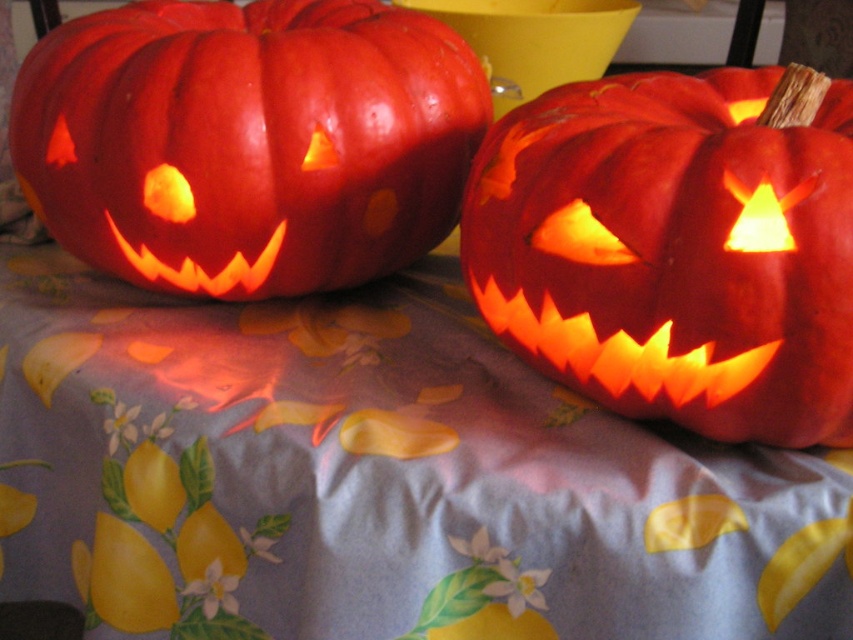
You are standing in front of the table with the two carved pumpkins. You notice two points marked on the tablecloth. Based on your perspective, which point is closer to you, point at position (837, 440) or point at position (56, 150)?

Point at position (837, 440) is closer to you than point at position (56, 150).

You are setting up a Halloween display and want to arrange the matte orange pumpkin at center and the matte orange pumpkin at left so that one is above the other. Based on their current positions, which pumpkin is already positioned above the other?

The matte orange pumpkin at left is positioned above the matte orange pumpkin at center because the matte orange pumpkin at center is located below it.

You are organizing a Halloween display and need to place a new pumpkin between the two existing pumpkins on the table. The new pumpkin must be placed to the right of the matte orange pumpkin at left but to the left of the matte orange pumpkin at center. Is this possible given their current positions?

The matte orange pumpkin at center is positioned on the right side of the matte orange pumpkin at left, so there is no space between them for the new pumpkin. Therefore, it is not possible to place the new pumpkin in the specified position.